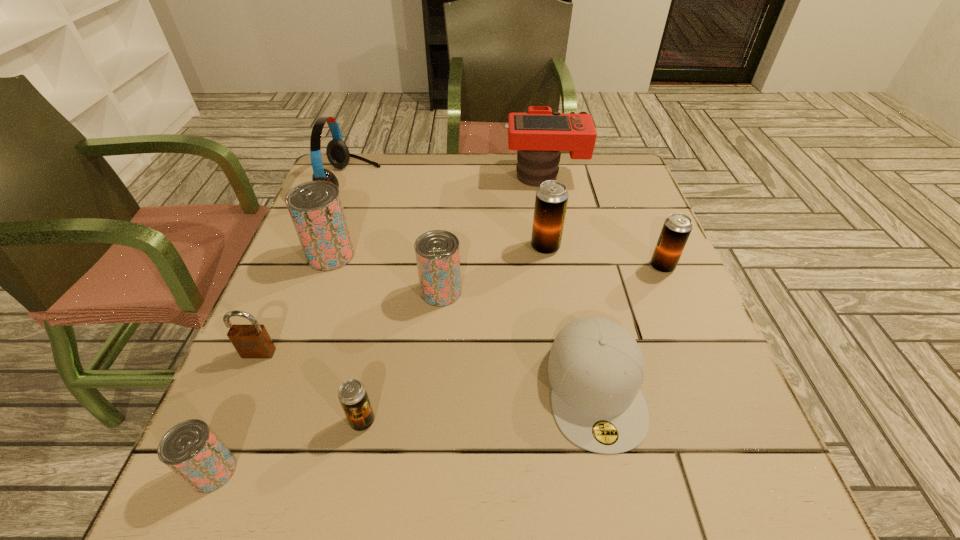
Where is `vacant space at the left edge of the desktop`? The image size is (960, 540). vacant space at the left edge of the desktop is located at coordinates (234, 402).

This screenshot has height=540, width=960. I want to click on blank space at the right edge, so click(655, 339).

You are a GUI agent. You are given a task and a screenshot of the screen. Output one action in this format:
    pyautogui.click(x=<x>, y=<y>)
    Task: Click on the free spot at the far left corner of the desktop
    The height and width of the screenshot is (540, 960).
    Given the screenshot: What is the action you would take?
    pyautogui.click(x=347, y=183)

The image size is (960, 540). Find the location of `vacant region at the far right corner`. vacant region at the far right corner is located at coordinates (597, 184).

The width and height of the screenshot is (960, 540). In the image, there is a desktop. What are the coordinates of `vacant space at the near right corner` in the screenshot? It's located at (764, 500).

Where is `free space between the padlock and the rightmost object`? The image size is (960, 540). free space between the padlock and the rightmost object is located at coordinates (461, 309).

Locate an element on the screen. free space between the sixth farthest object and the fifth object from left to right is located at coordinates (401, 356).

Find the location of a particular element. This screenshot has width=960, height=540. free space that is in between the fifth beer can from left to right and the brown padlock is located at coordinates (402, 300).

Identify the location of empty space that is in between the biggest red beer can and the fifth farthest beer can. (347, 338).

Where is `free area in between the camera and the nearest red beer can`? free area in between the camera and the nearest red beer can is located at coordinates (379, 322).